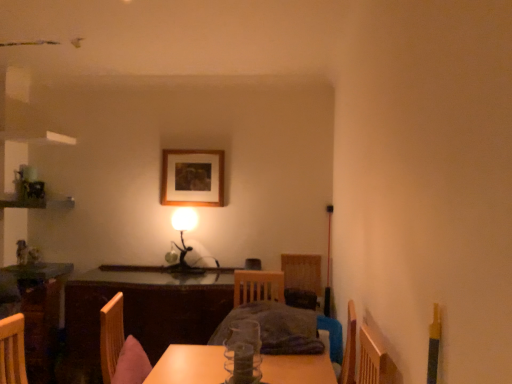
Question: Is matte black table lamp at center positioned beyond the bounds of wooden table at center?

Choices:
 (A) no
 (B) yes

Answer: (B)

Question: Is matte black table lamp at center bigger than wooden table at center?

Choices:
 (A) no
 (B) yes

Answer: (A)

Question: From the image's perspective, is matte black table lamp at center on wooden table at center?

Choices:
 (A) no
 (B) yes

Answer: (B)

Question: Considering the relative positions of matte black table lamp at center and wooden table at center in the image provided, is matte black table lamp at center to the right of wooden table at center from the viewer's perspective?

Choices:
 (A) no
 (B) yes

Answer: (B)

Question: Can you confirm if matte black table lamp at center is wider than wooden table at center?

Choices:
 (A) no
 (B) yes

Answer: (A)

Question: In the image, is wooden table at center on the left side or the right side of matte black table lamp at center?

Choices:
 (A) left
 (B) right

Answer: (A)

Question: From a real-world perspective, is wooden table at center above or below matte black table lamp at center?

Choices:
 (A) below
 (B) above

Answer: (A)

Question: From their relative heights in the image, would you say wooden table at center is taller or shorter than matte black table lamp at center?

Choices:
 (A) short
 (B) tall

Answer: (B)

Question: Is wooden table at center inside the boundaries of matte black table lamp at center, or outside?

Choices:
 (A) inside
 (B) outside

Answer: (B)

Question: From a real-world perspective, is wooden picture frame at center above or below clear glass vase at center?

Choices:
 (A) below
 (B) above

Answer: (B)

Question: From their relative heights in the image, would you say wooden picture frame at center is taller or shorter than clear glass vase at center?

Choices:
 (A) tall
 (B) short

Answer: (A)

Question: Would you say wooden picture frame at center is inside or outside clear glass vase at center?

Choices:
 (A) outside
 (B) inside

Answer: (A)

Question: Is wooden picture frame at center in front of or behind clear glass vase at center in the image?

Choices:
 (A) front
 (B) behind

Answer: (B)

Question: Looking at the image, does wooden table at center seem bigger or smaller compared to wooden picture frame at center?

Choices:
 (A) small
 (B) big

Answer: (B)

Question: In terms of width, does wooden table at center look wider or thinner when compared to wooden picture frame at center?

Choices:
 (A) thin
 (B) wide

Answer: (B)